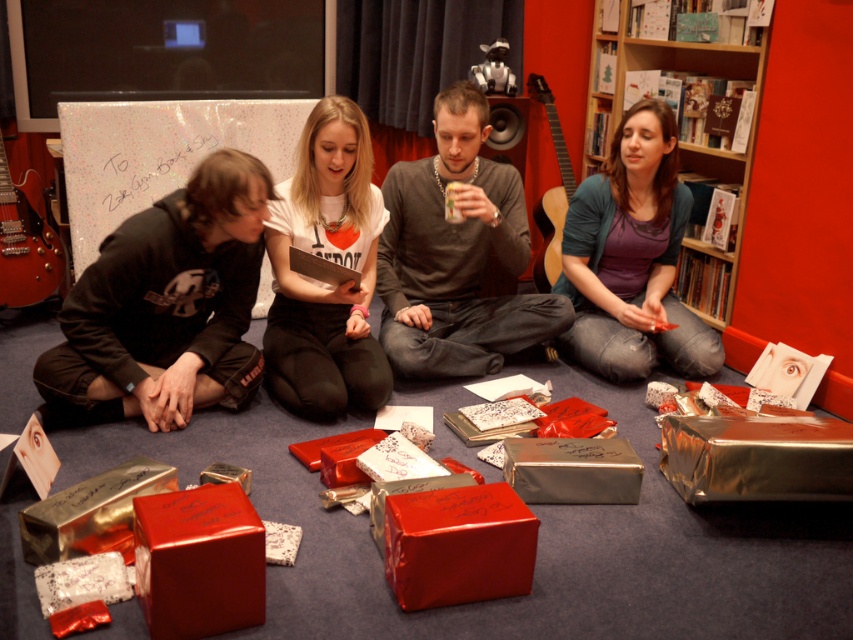
Question: Which is nearer to the matte gray sweater at center?

Choices:
 (A) white matte t-shirt at center
 (B) matte black hoodie at left

Answer: (A)

Question: Does matte purple shirt at center come in front of shiny metallic box at lower left?

Choices:
 (A) yes
 (B) no

Answer: (B)

Question: Can you confirm if matte black hoodie at left is positioned below metallic silver box at center?

Choices:
 (A) no
 (B) yes

Answer: (A)

Question: Does white matte t-shirt at center come in front of shiny red box at center?

Choices:
 (A) yes
 (B) no

Answer: (B)

Question: Which of the following is the farthest from the observer?

Choices:
 (A) matte purple shirt at center
 (B) metallic silver box at center
 (C) metallic silver box at lower right
 (D) shiny red box at center

Answer: (A)

Question: Among these points, which one is farthest from the camera?

Choices:
 (A) tap(229, 404)
 (B) tap(80, 536)
 (C) tap(508, 211)

Answer: (C)